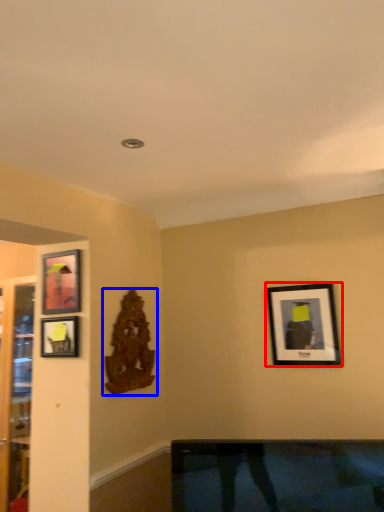
Question: Which object appears closest to the camera in this image, picture frame (highlighted by a red box) or art (highlighted by a blue box)?

Choices:
 (A) picture frame
 (B) art

Answer: (A)